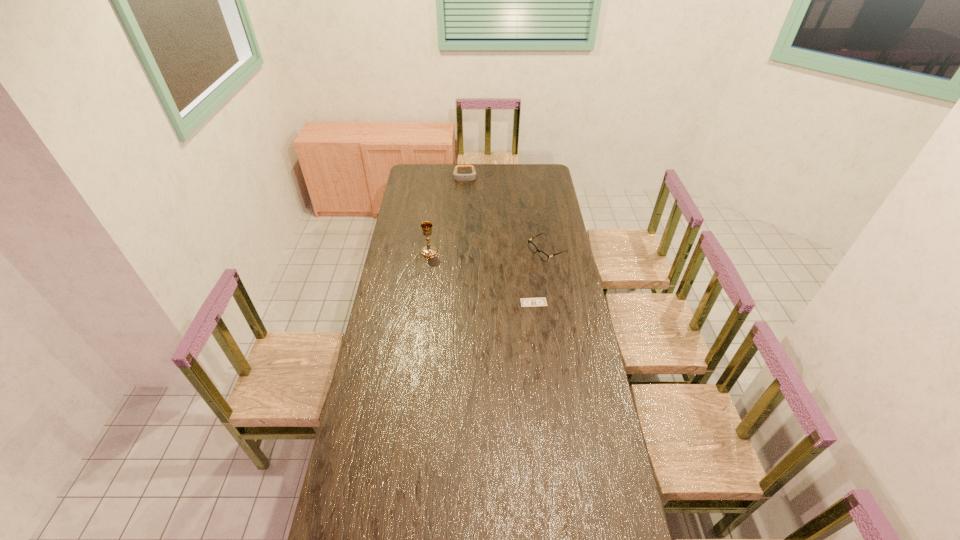
This screenshot has height=540, width=960. I want to click on vacant space on the desktop that is between the leftmost object and the shortest object and is positioned on the front-facing side of the spectacles, so click(488, 280).

Image resolution: width=960 pixels, height=540 pixels. I want to click on free space on the desktop that is between the tallest object and the nearest object and is positioned on the front and back of the goggles, so click(x=467, y=271).